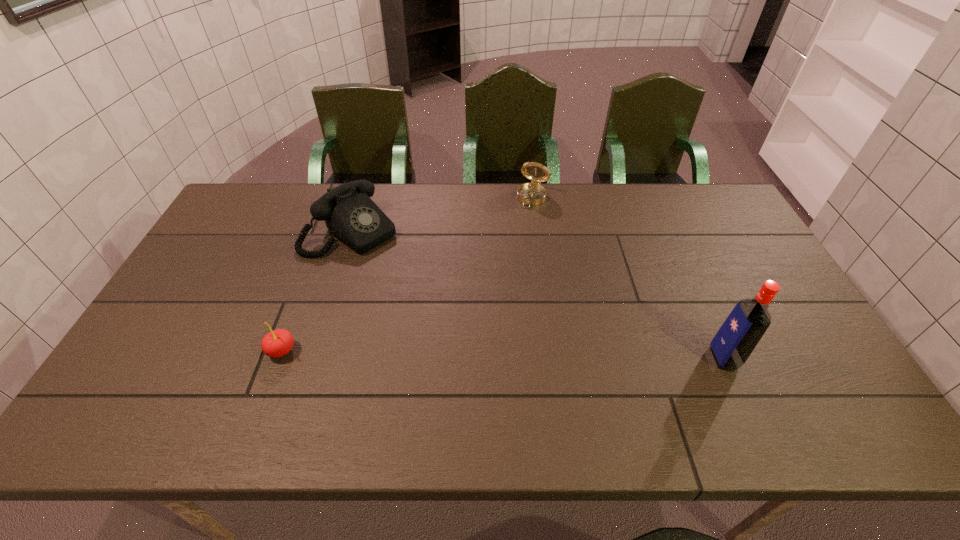
Image resolution: width=960 pixels, height=540 pixels. In order to click on vacant space located 0.200m with the dial facing the compass in this screenshot , I will do `click(511, 244)`.

The height and width of the screenshot is (540, 960). I want to click on free space located with the dial facing the compass, so click(x=503, y=259).

This screenshot has width=960, height=540. I want to click on vacant space located with the dial facing the compass, so click(499, 267).

Find the location of a particular element. telephone that is at the far edge is located at coordinates (350, 215).

Where is `compass located in the far edge section of the desktop`? Image resolution: width=960 pixels, height=540 pixels. compass located in the far edge section of the desktop is located at coordinates (533, 193).

Locate an element on the screen. The width and height of the screenshot is (960, 540). cherry present at the near edge is located at coordinates (277, 343).

Locate an element on the screen. The image size is (960, 540). vodka at the near edge is located at coordinates (748, 321).

The height and width of the screenshot is (540, 960). I want to click on blank space at the far edge, so click(x=431, y=221).

Locate an element on the screen. This screenshot has width=960, height=540. vacant space at the near edge of the desktop is located at coordinates coord(688,374).

Identify the location of vacant space at the left edge of the desktop. This screenshot has width=960, height=540. (194, 276).